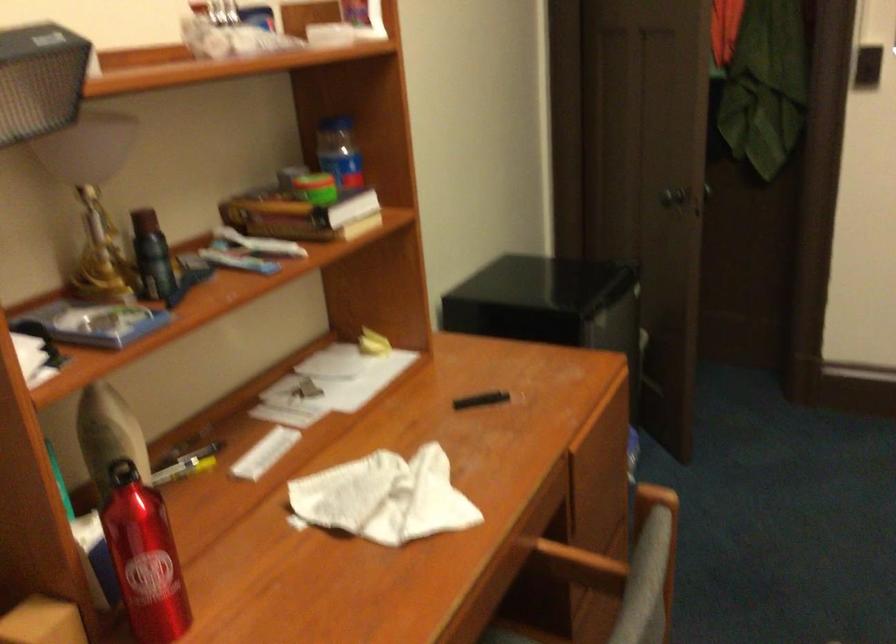
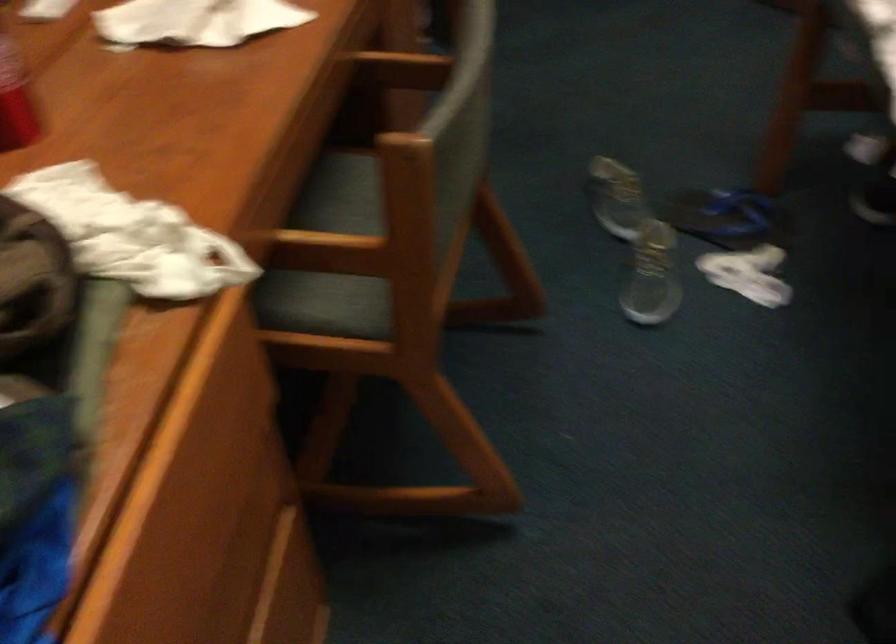
The point at (581, 569) is marked in the first image. Where is the corresponding point in the second image?

(401, 69)